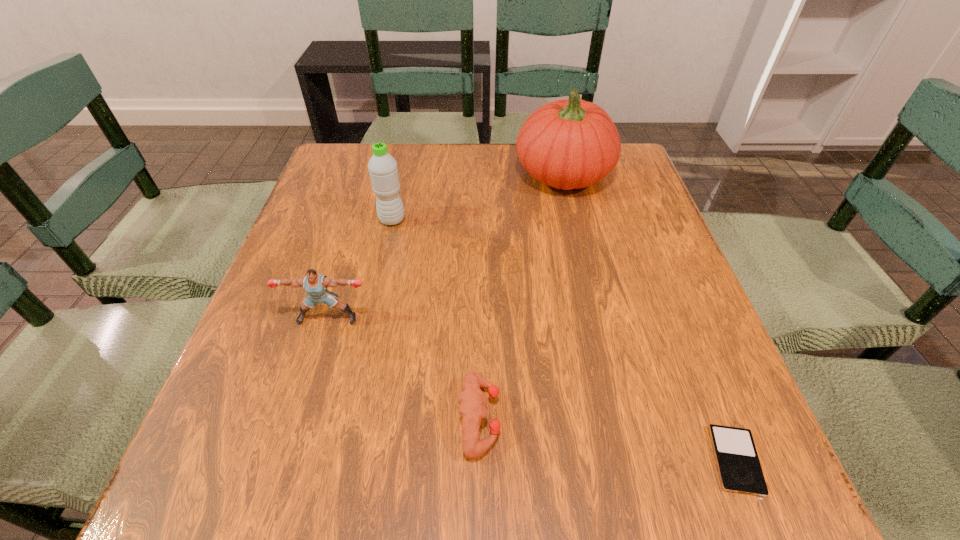
This screenshot has width=960, height=540. I want to click on free spot between the farthest object and the water bottle, so click(x=478, y=197).

Locate an element on the screen. free space between the third farthest object and the shortest object is located at coordinates (532, 389).

Locate an element on the screen. Image resolution: width=960 pixels, height=540 pixels. unoccupied area between the shortest object and the left puncher is located at coordinates (532, 389).

Where is `free space between the second shortest object and the shortest object`? free space between the second shortest object and the shortest object is located at coordinates (608, 439).

Find the location of a particular element. Image resolution: width=960 pixels, height=540 pixels. free space between the second shortest object and the farthest object is located at coordinates click(521, 296).

Identify the location of free space between the third object from left to right and the iPod. This screenshot has width=960, height=540. (608, 439).

Locate an element on the screen. This screenshot has width=960, height=540. object that is the second closest one to the shorter puncher is located at coordinates (739, 468).

This screenshot has height=540, width=960. In order to click on the fourth closest object to the taller puncher in this screenshot , I will do `click(739, 468)`.

This screenshot has width=960, height=540. Find the location of `vacant space that satisfies the following two spatial constraints: 1. on the front-facing side of the iPod; 2. on the left side of the third nearest object`. vacant space that satisfies the following two spatial constraints: 1. on the front-facing side of the iPod; 2. on the left side of the third nearest object is located at coordinates (284, 460).

Find the location of a particular element. vacant region that satisfies the following two spatial constraints: 1. on the front side of the shortest object; 2. on the right side of the fourth shortest object is located at coordinates (339, 460).